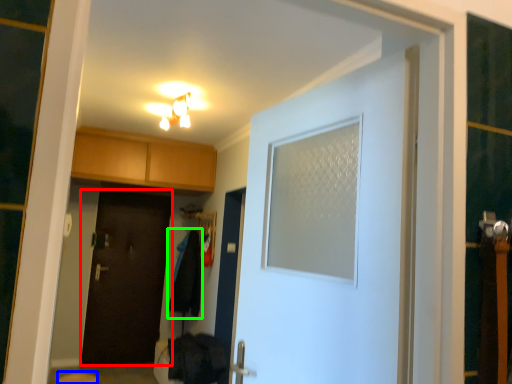
Question: Which is nearer to the door (highlighted by a red box)? step stool (highlighted by a blue box) or laundry (highlighted by a green box).

Choices:
 (A) step stool
 (B) laundry

Answer: (B)